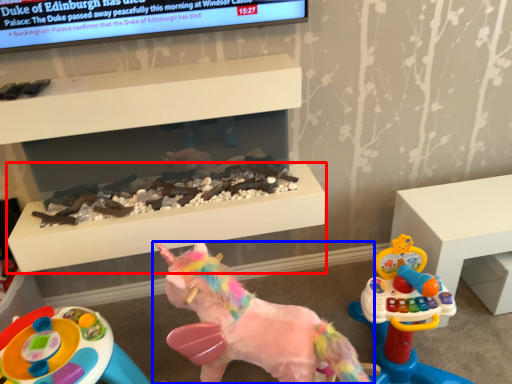
Question: Which point is closer to the camera, table (highlighted by a red box) or toy (highlighted by a blue box)?

Choices:
 (A) table
 (B) toy

Answer: (B)